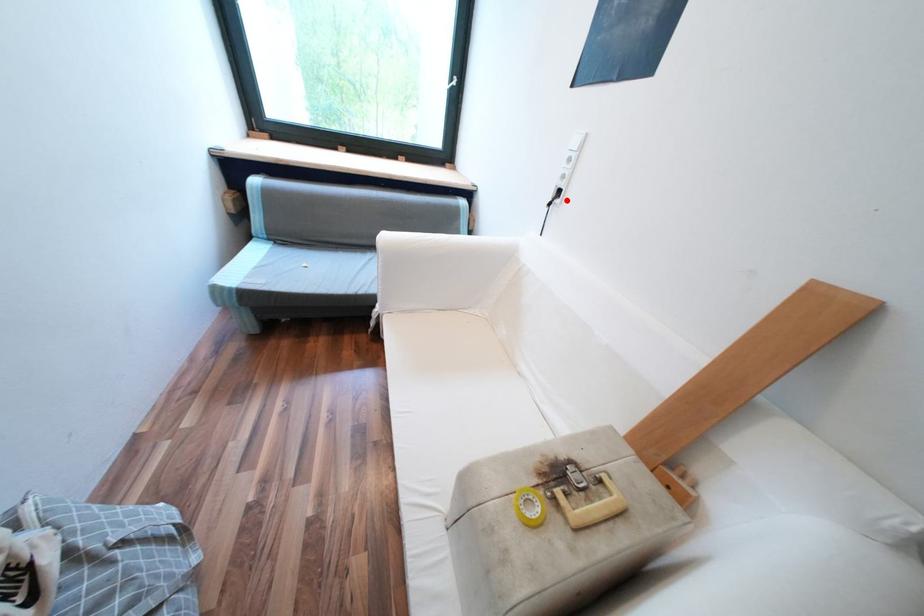
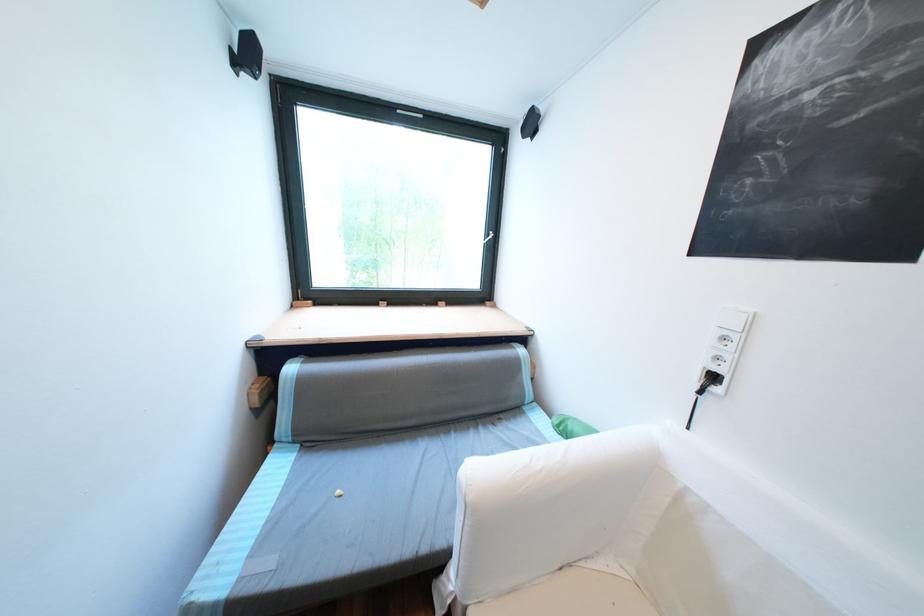
Find the pixel in the second image that matches the highlighted location in the first image.

(725, 390)